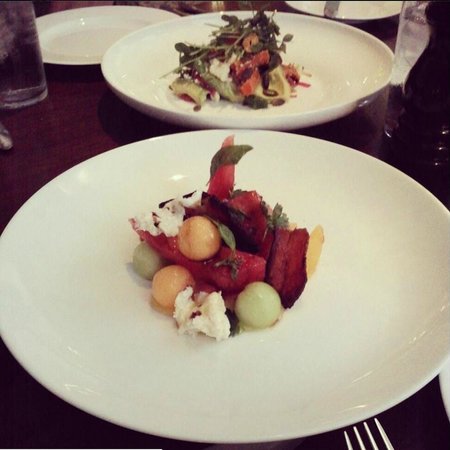
Where is `fork`? The width and height of the screenshot is (450, 450). fork is located at coordinates (383, 432).